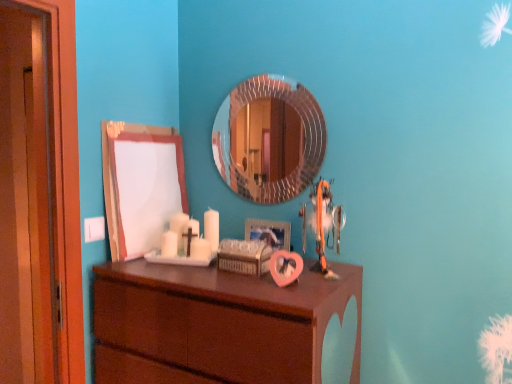
Where is `vacant space in front of orange fabric toy at center`? This screenshot has width=512, height=384. vacant space in front of orange fabric toy at center is located at coordinates (313, 283).